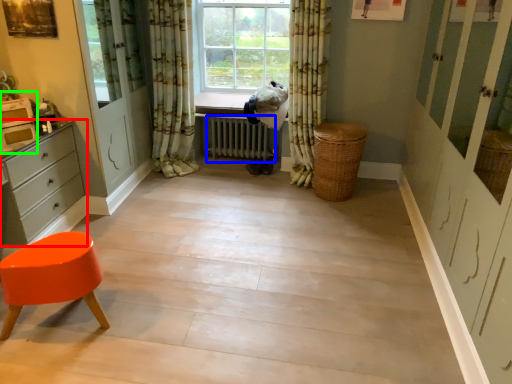
Question: Estimate the real-world distances between objects in this image. Which object is closer to chest of drawers (highlighted by a red box), radiator (highlighted by a blue box) or appliance (highlighted by a green box)?

Choices:
 (A) radiator
 (B) appliance

Answer: (B)